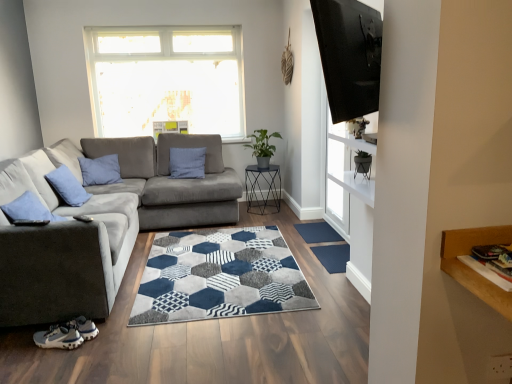
Question: In which direction should I rotate to look at blue textured doormat at center, acting as the first doormat starting from the front?

Choices:
 (A) right
 (B) left

Answer: (A)

Question: Is transparent glass door at upper right bigger than metallic hexagonal table at center?

Choices:
 (A) yes
 (B) no

Answer: (B)

Question: Is transparent glass door at upper right at the left side of metallic hexagonal table at center?

Choices:
 (A) no
 (B) yes

Answer: (A)

Question: From a real-world perspective, is transparent glass door at upper right positioned under metallic hexagonal table at center based on gravity?

Choices:
 (A) yes
 (B) no

Answer: (B)

Question: Can you confirm if transparent glass door at upper right is wider than metallic hexagonal table at center?

Choices:
 (A) no
 (B) yes

Answer: (A)

Question: Is transparent glass door at upper right positioned with its back to metallic hexagonal table at center?

Choices:
 (A) yes
 (B) no

Answer: (B)

Question: Is transparent glass door at upper right not inside metallic hexagonal table at center?

Choices:
 (A) no
 (B) yes

Answer: (B)

Question: Is blue textured doormat at center, the first doormat ordered from the bottom, directly adjacent to gray fabric couch at left?

Choices:
 (A) no
 (B) yes

Answer: (A)

Question: From a real-world perspective, is blue textured doormat at center, placed as the second doormat when sorted from top to bottom, positioned over gray fabric couch at left based on gravity?

Choices:
 (A) no
 (B) yes

Answer: (A)

Question: Does blue textured doormat at center, acting as the first doormat starting from the front, have a smaller size compared to gray fabric couch at left?

Choices:
 (A) no
 (B) yes

Answer: (B)

Question: From a real-world perspective, is blue textured doormat at center, acting as the first doormat starting from the front, below gray fabric couch at left?

Choices:
 (A) yes
 (B) no

Answer: (A)

Question: Is blue textured doormat at center, acting as the first doormat starting from the front, bigger than gray fabric couch at left?

Choices:
 (A) yes
 (B) no

Answer: (B)

Question: Is the position of blue textured doormat at center, the first doormat ordered from the bottom, more distant than that of gray fabric couch at left?

Choices:
 (A) no
 (B) yes

Answer: (B)

Question: Can you confirm if metallic hexagonal table at center is shorter than velvet blue pillow at left?

Choices:
 (A) no
 (B) yes

Answer: (A)